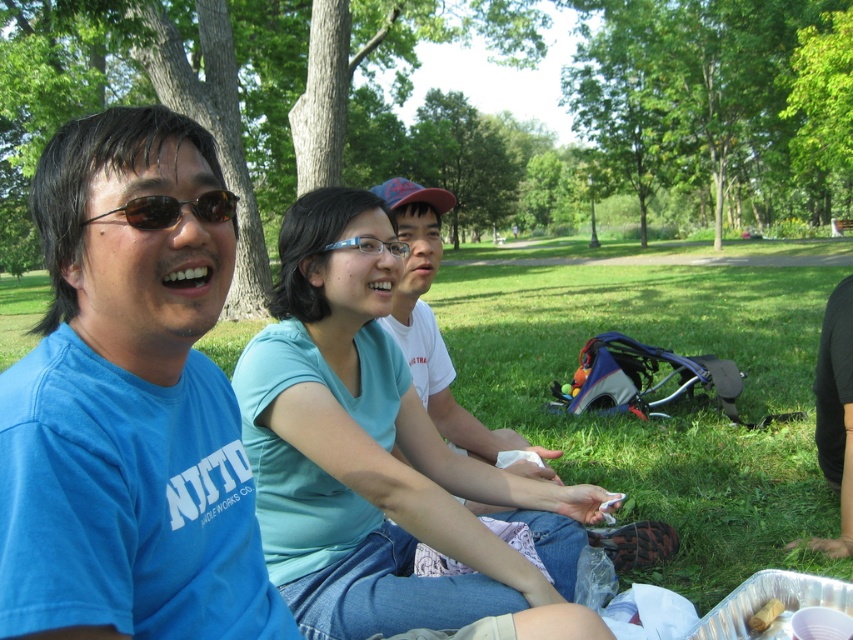
Question: Is light blue fabric shirt at center thinner than brown paper bag at lower right?

Choices:
 (A) no
 (B) yes

Answer: (A)

Question: Which is nearer to the blue plastic glasses at center?

Choices:
 (A) green grass at center
 (B) tortoiseshell plastic sunglasses at upper left
 (C) light blue fabric shirt at center

Answer: (C)

Question: Among these points, which one is nearest to the camera?

Choices:
 (A) (808, 560)
 (B) (502, 444)
 (C) (363, 248)

Answer: (C)

Question: Is blue t-shirt at left behind tortoiseshell plastic sunglasses at upper left?

Choices:
 (A) no
 (B) yes

Answer: (A)

Question: Does green grass at center appear on the right side of brown paper bag at lower right?

Choices:
 (A) yes
 (B) no

Answer: (B)

Question: Considering the real-world distances, which object is closest to the white cotton shirt at center?

Choices:
 (A) light blue fabric shirt at center
 (B) green grass at center
 (C) tortoiseshell plastic sunglasses at upper left

Answer: (A)